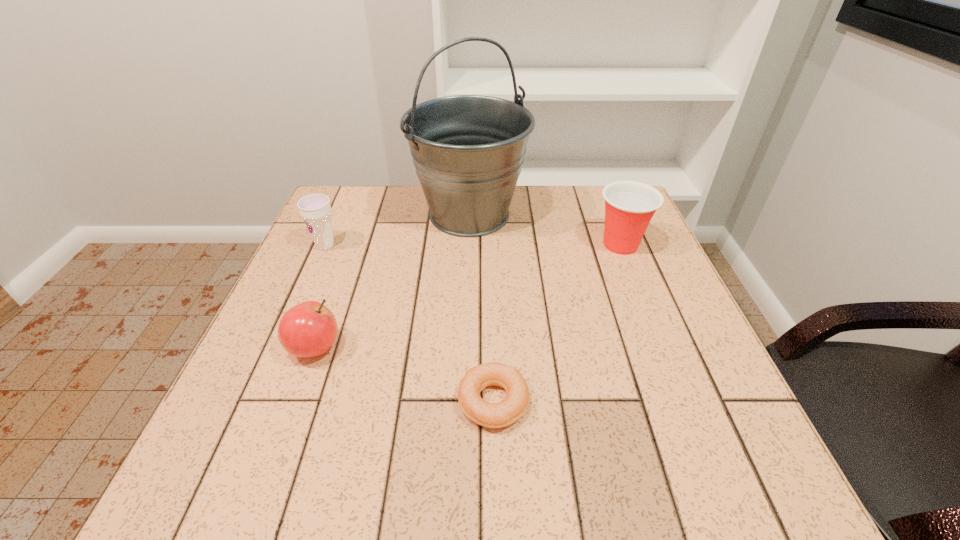
Where is `vacant space that satisfies the following two spatial constraints: 1. on the front side of the bagel; 2. on the right side of the bucket`? vacant space that satisfies the following two spatial constraints: 1. on the front side of the bagel; 2. on the right side of the bucket is located at coordinates (464, 402).

Where is `free point that satisfies the following two spatial constraints: 1. on the back side of the bucket; 2. on the right side of the left cup`? free point that satisfies the following two spatial constraints: 1. on the back side of the bucket; 2. on the right side of the left cup is located at coordinates click(x=339, y=214).